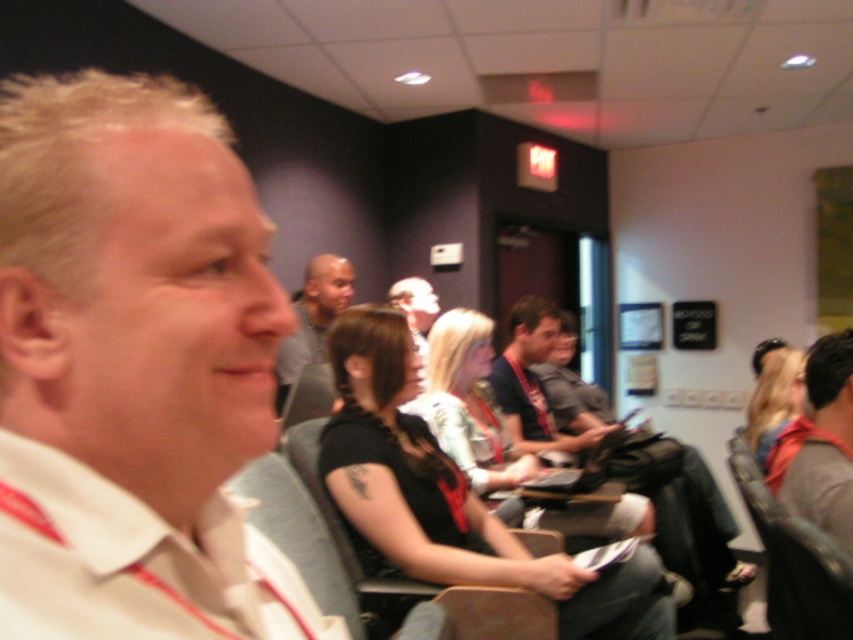
You are a photographer trying to capture a candid shot of the gray fabric shirt at center without including the white cotton shirt at left in the frame. Based on their positions, is this possible?

The white cotton shirt at left is positioned on the right side of gray fabric shirt at center, so if you position yourself to the left side of the gray fabric shirt at center, you can capture the gray fabric shirt at center without including the white cotton shirt at left in the frame.

You are attending a meeting and notice two attendees wearing shirts. The first attendee has a white cotton shirt at left, and the second has a gray fabric shirt at center. Which attendee is wearing a shorter shirt?

The white cotton shirt at left is shorter than the gray fabric shirt at center, so the attendee wearing the white cotton shirt at left has a shorter shirt.